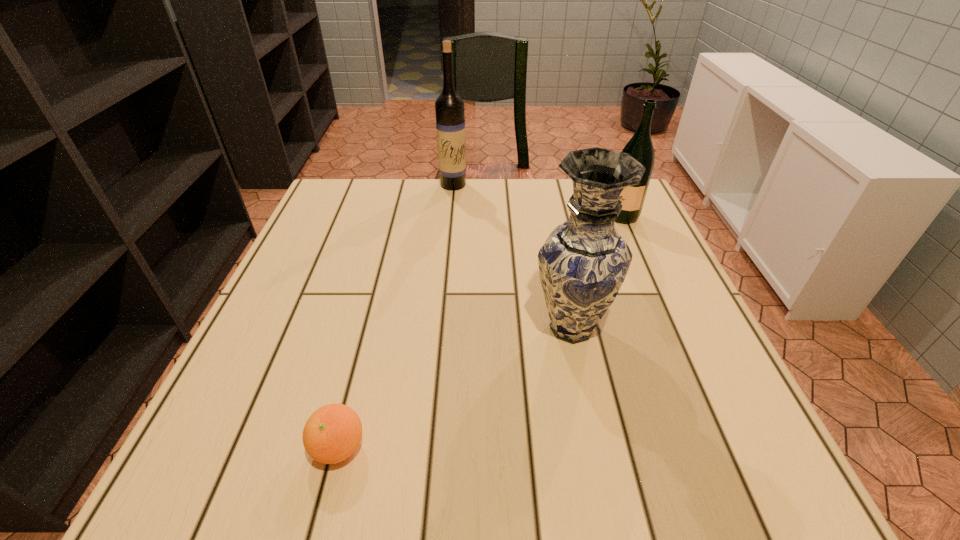
The width and height of the screenshot is (960, 540). I want to click on free spot between the left wine bottle and the second shortest object, so click(x=535, y=201).

At what (x,y) coordinates should I click in order to perform the action: click on object that is the closest to the left wine bottle. Please return your answer as a coordinate pair (x, y). This screenshot has width=960, height=540. Looking at the image, I should click on (640, 147).

I want to click on object that stands as the closest to the second object from right to left, so click(640, 147).

Find the location of a particular element. The width and height of the screenshot is (960, 540). free spot that satisfies the following two spatial constraints: 1. on the label of the farthest object; 2. on the left side of the vase is located at coordinates (441, 328).

This screenshot has width=960, height=540. Identify the location of free space that satisfies the following two spatial constraints: 1. on the label of the second nearest object; 2. on the right side of the second object from left to right. (441, 328).